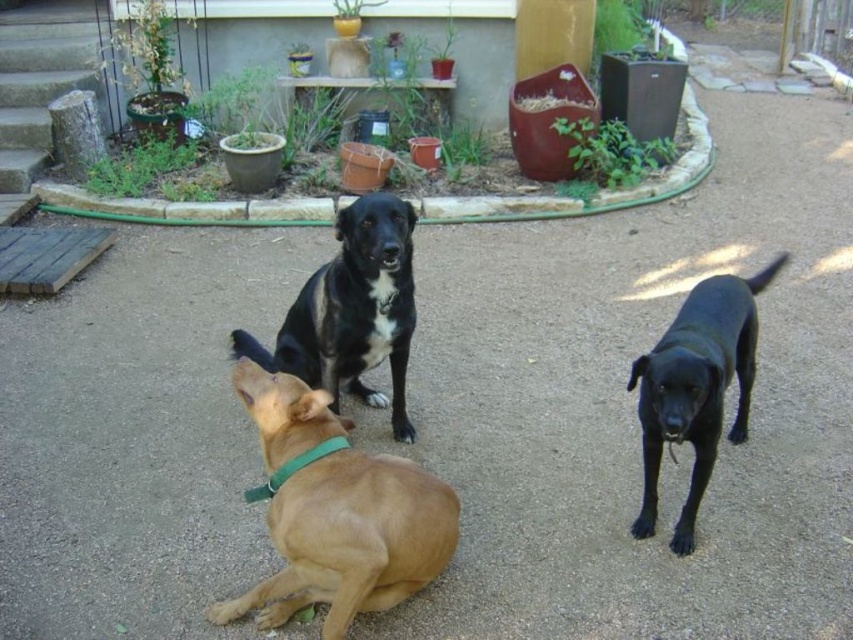
Question: Estimate the real-world distances between objects in this image. Which object is closer to the black matte dog at center?

Choices:
 (A) black glossy dog at center
 (B) golden fur dog at center

Answer: (B)

Question: Does black matte dog at center appear on the right side of black glossy dog at center?

Choices:
 (A) no
 (B) yes

Answer: (A)

Question: Which of the following is the closest to the observer?

Choices:
 (A) black matte dog at center
 (B) golden fur dog at center

Answer: (B)

Question: Which point appears farthest from the camera in this image?

Choices:
 (A) tap(267, 593)
 (B) tap(721, 372)

Answer: (B)

Question: Is golden fur dog at center thinner than black matte dog at center?

Choices:
 (A) yes
 (B) no

Answer: (A)

Question: Is golden fur dog at center further to the viewer compared to black matte dog at center?

Choices:
 (A) yes
 (B) no

Answer: (B)